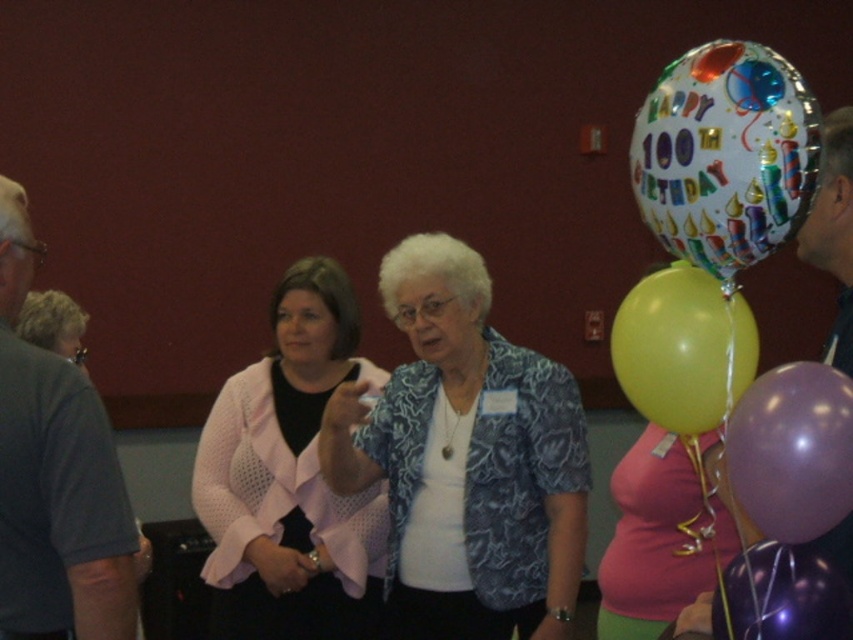
Question: Can you confirm if pink fabric jacket at center is positioned to the left of shiny metallic balloon at center?

Choices:
 (A) no
 (B) yes

Answer: (B)

Question: Among these objects, which one is farthest from the camera?

Choices:
 (A) pink fabric dress at lower right
 (B) blue textured blouse at center
 (C) gray t-shirt at left
 (D) shiny metallic balloon at center

Answer: (B)

Question: Is pink fabric jacket at center thinner than shiny metallic balloon at center?

Choices:
 (A) yes
 (B) no

Answer: (B)

Question: Observing the image, what is the correct spatial positioning of white glossy balloon at upper right in reference to matte yellow balloon at right?

Choices:
 (A) left
 (B) right

Answer: (B)

Question: Which is nearer to the white glossy balloon at upper right?

Choices:
 (A) pink fabric dress at lower right
 (B) matte yellow balloon at right
 (C) purple rubber balloon at right

Answer: (B)

Question: Which point is closer to the camera taking this photo?

Choices:
 (A) (693, 400)
 (B) (786, 426)

Answer: (B)